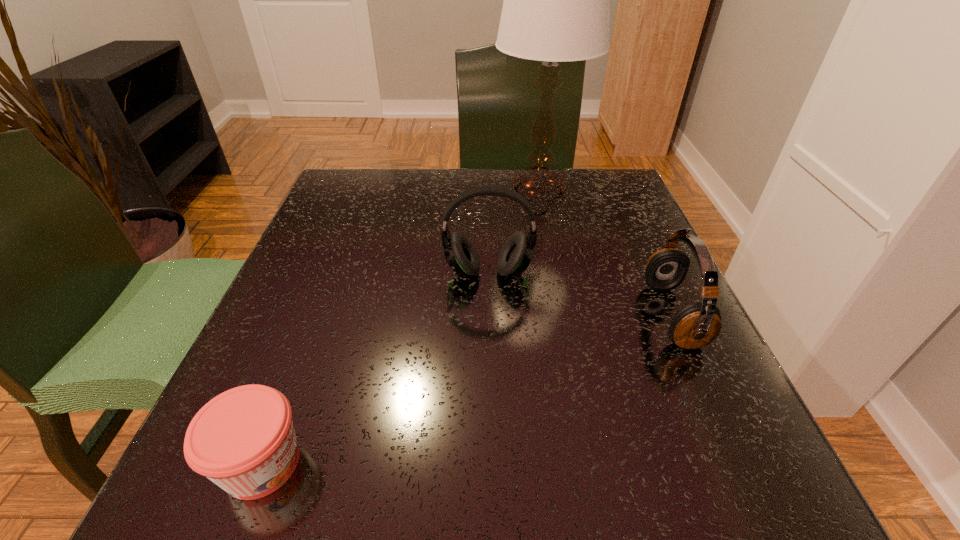
What are the coordinates of `vacant space located on the front-facing side of the tallest object` in the screenshot? It's located at (394, 191).

Locate an element on the screen. vacant point located on the ear cups of the left headset is located at coordinates (490, 333).

The image size is (960, 540). What are the coordinates of `free location located 0.260m on the ear cups of the shorter headset` in the screenshot? It's located at (499, 315).

The image size is (960, 540). Identify the location of vacant space situated on the ear cups of the shorter headset. (482, 315).

This screenshot has width=960, height=540. I want to click on vacant space positioned on the ear cups of the shorter headset, so click(x=424, y=315).

Identify the location of free space located 0.150m on the front label of the jam. This screenshot has width=960, height=540. (425, 463).

The image size is (960, 540). Identify the location of object located at the far edge. (556, 8).

Find the location of a particular element. This screenshot has height=540, width=960. object present at the near edge is located at coordinates (243, 440).

The width and height of the screenshot is (960, 540). What are the coordinates of `object that is at the left edge` in the screenshot? It's located at (243, 440).

Find the location of a particular element. The image size is (960, 540). table lamp positioned at the right edge is located at coordinates (556, 8).